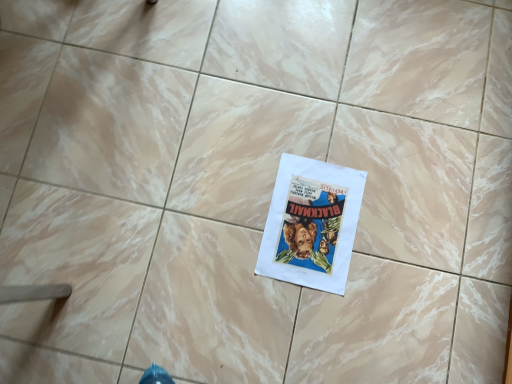
The height and width of the screenshot is (384, 512). Identify the location of empty space that is ontop of white paper poster at center. (312, 224).